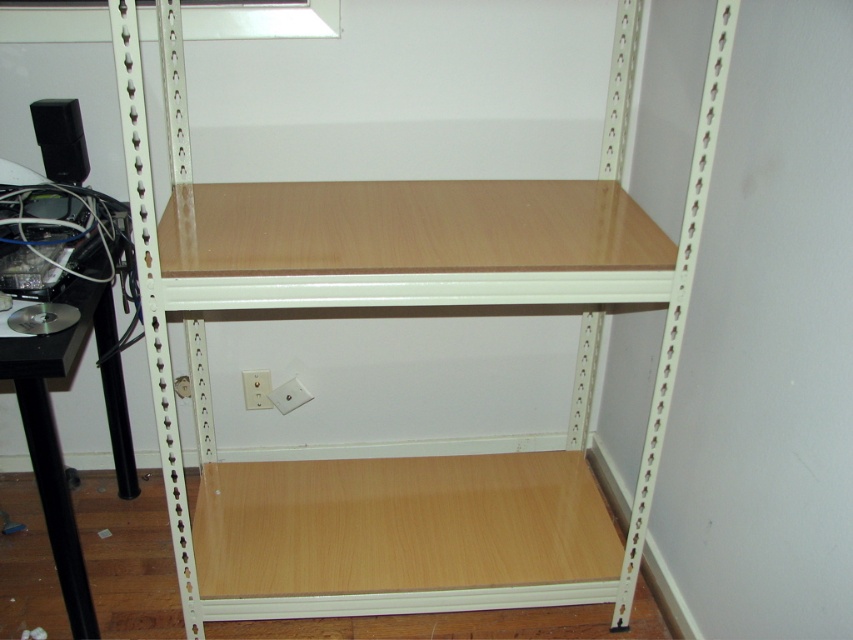
In order to click on wooden shelf at center in this screenshot , I will do `click(401, 307)`.

Does wooden shelf at center have a larger size compared to black plastic computer desk at left?

Yes.

What do you see at coordinates (401, 307) in the screenshot? This screenshot has height=640, width=853. I see `wooden shelf at center` at bounding box center [401, 307].

Locate an element on the screen. This screenshot has height=640, width=853. wooden shelf at center is located at coordinates (401, 307).

At what (x,y) coordinates should I click in order to perform the action: click on black plastic computer desk at left. Please return your answer as a coordinate pair (x, y). The height and width of the screenshot is (640, 853). Looking at the image, I should click on (65, 356).

Which is in front, point (90, 248) or point (80, 164)?

Point (90, 248)

You are a GUI agent. You are given a task and a screenshot of the screen. Output one action in this format:
    pyautogui.click(x=<x>, y=<y>)
    Task: Click on the black plastic computer desk at left
    The image size is (853, 640).
    Given the screenshot: What is the action you would take?
    pyautogui.click(x=65, y=356)

Image resolution: width=853 pixels, height=640 pixels. I want to click on black plastic computer desk at left, so click(x=65, y=356).

Does wooden shelf at center appear on the left side of white plastic electric outlet at lower center?

Incorrect, wooden shelf at center is not on the left side of white plastic electric outlet at lower center.

Is wooden shelf at center taller than white plastic electric outlet at lower center?

Yes, wooden shelf at center is taller than white plastic electric outlet at lower center.

Between point (432, 488) and point (264, 396), which one is positioned in front?

Point (432, 488)

This screenshot has height=640, width=853. Find the location of `wooden shelf at center`. wooden shelf at center is located at coordinates (401, 307).